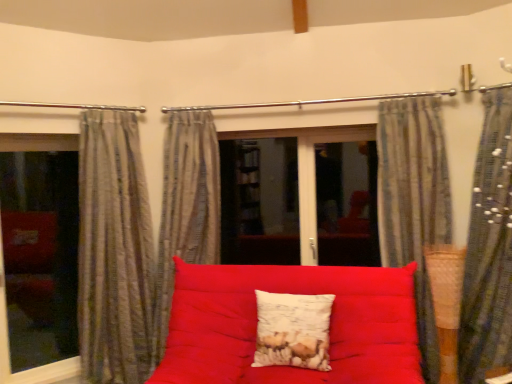
Question: From the image's perspective, is striped fabric curtain at right, the fourth curtain from the left, above or below matte red fabric studio couch at center?

Choices:
 (A) above
 (B) below

Answer: (A)

Question: Looking at the image, does striped fabric curtain at right, which appears as the 1th curtain when viewed from the right, seem bigger or smaller compared to matte red fabric studio couch at center?

Choices:
 (A) small
 (B) big

Answer: (A)

Question: Based on their relative distances, which object is nearer to the gray striped curtain at left, which is the 4th curtain from right to left?

Choices:
 (A) white textured pillow at center
 (B) metallic rod at upper center
 (C) transparent glass window at left
 (D) striped fabric curtain at center, which is the 3th curtain in right-to-left order
 (E) striped fabric curtain at right, the fourth curtain from the left

Answer: (D)

Question: Estimate the real-world distances between objects in this image. Which object is farther from the striped fabric curtain at center, the 2th curtain from the left?

Choices:
 (A) matte red fabric studio couch at center
 (B) striped fabric curtain at right, the fourth curtain from the left
 (C) transparent glass window at left
 (D) gray striped curtain at left, which is the 4th curtain from right to left
 (E) striped fabric curtain at upper right, the 2th curtain in the right-to-left sequence

Answer: (B)